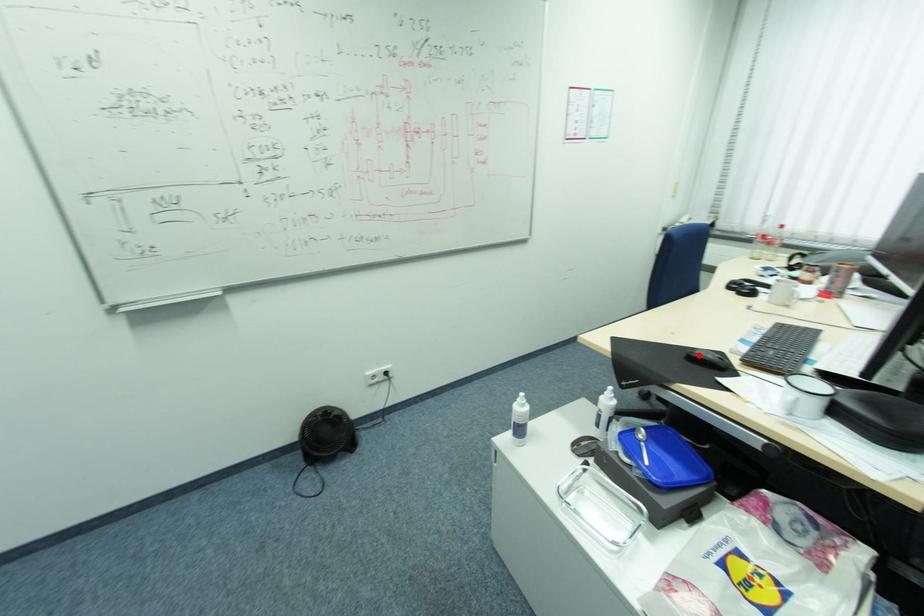
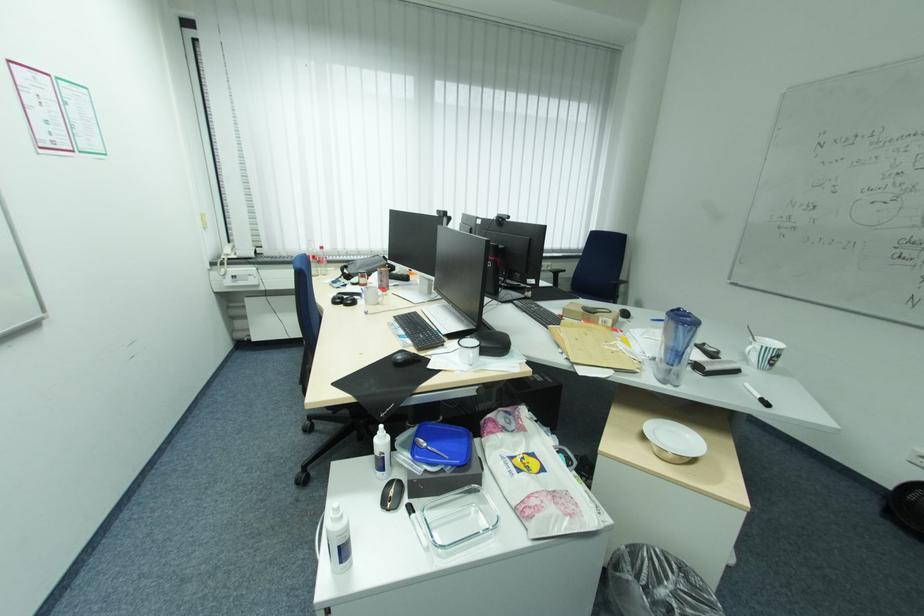
The point at the highlighted location is marked in the first image. Where is the corresponding point in the second image?

(406, 361)